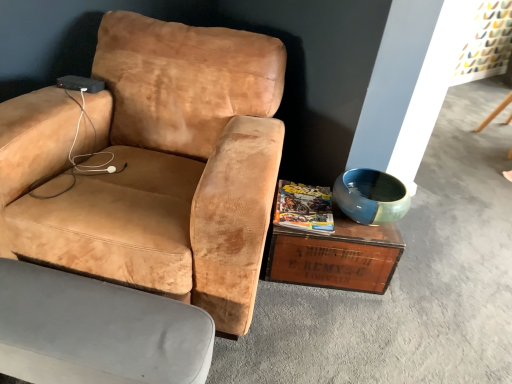
Question: Is velvet beige armchair at lower left, the 1th chair in the bottom-to-top sequence, further to camera compared to matte yellow magazine at center?

Choices:
 (A) no
 (B) yes

Answer: (A)

Question: Can you confirm if velvet beige armchair at lower left, the 1th chair in the bottom-to-top sequence, is wider than matte yellow magazine at center?

Choices:
 (A) yes
 (B) no

Answer: (B)

Question: Does velvet beige armchair at lower left, the 1th chair in the bottom-to-top sequence, have a lesser height compared to matte yellow magazine at center?

Choices:
 (A) yes
 (B) no

Answer: (B)

Question: Does velvet beige armchair at lower left, the 2th chair when ordered from top to bottom, have a larger size compared to matte yellow magazine at center?

Choices:
 (A) no
 (B) yes

Answer: (B)

Question: Does velvet beige armchair at lower left, the 1th chair in the bottom-to-top sequence, appear on the right side of matte yellow magazine at center?

Choices:
 (A) yes
 (B) no

Answer: (B)

Question: Considering the positions of blue glossy bowl at right and velvet beige armchair at lower left, the 2th chair when ordered from top to bottom, in the image, is blue glossy bowl at right taller or shorter than velvet beige armchair at lower left, the 2th chair when ordered from top to bottom,?

Choices:
 (A) tall
 (B) short

Answer: (B)

Question: In the image, is blue glossy bowl at right positioned in front of or behind velvet beige armchair at lower left, the 1th chair in the bottom-to-top sequence?

Choices:
 (A) behind
 (B) front

Answer: (A)

Question: Based on their positions, is blue glossy bowl at right located to the left or right of velvet beige armchair at lower left, the 1th chair in the bottom-to-top sequence?

Choices:
 (A) left
 (B) right

Answer: (B)

Question: Considering the positions of blue glossy bowl at right and velvet beige armchair at lower left, the 2th chair when ordered from top to bottom, in the image, is blue glossy bowl at right bigger or smaller than velvet beige armchair at lower left, the 2th chair when ordered from top to bottom,?

Choices:
 (A) big
 (B) small

Answer: (B)

Question: Relative to wooden crate at lower right, is suede tan chair at center, the second chair from the bottom, in front or behind?

Choices:
 (A) behind
 (B) front

Answer: (B)

Question: Do you think suede tan chair at center, the 1th chair from the top, is within wooden crate at lower right, or outside of it?

Choices:
 (A) inside
 (B) outside

Answer: (B)

Question: Visually, is suede tan chair at center, the 1th chair from the top, positioned to the left or to the right of wooden crate at lower right?

Choices:
 (A) left
 (B) right

Answer: (A)

Question: Is suede tan chair at center, the second chair from the bottom, taller or shorter than wooden crate at lower right?

Choices:
 (A) tall
 (B) short

Answer: (A)

Question: Considering the positions of wooden crate at lower right and suede tan chair at center, the second chair from the bottom, in the image, is wooden crate at lower right bigger or smaller than suede tan chair at center, the second chair from the bottom,?

Choices:
 (A) big
 (B) small

Answer: (B)

Question: Is wooden crate at lower right taller or shorter than suede tan chair at center, the second chair from the bottom?

Choices:
 (A) short
 (B) tall

Answer: (A)